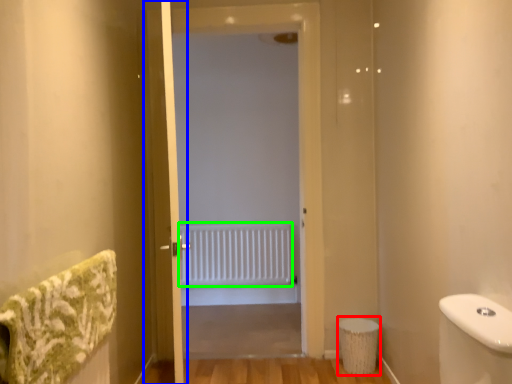
Question: Considering the real-world distances, which object is closest to toilet bowl (highlighted by a red box)? screen door (highlighted by a blue box) or radiator (highlighted by a green box).

Choices:
 (A) screen door
 (B) radiator

Answer: (A)